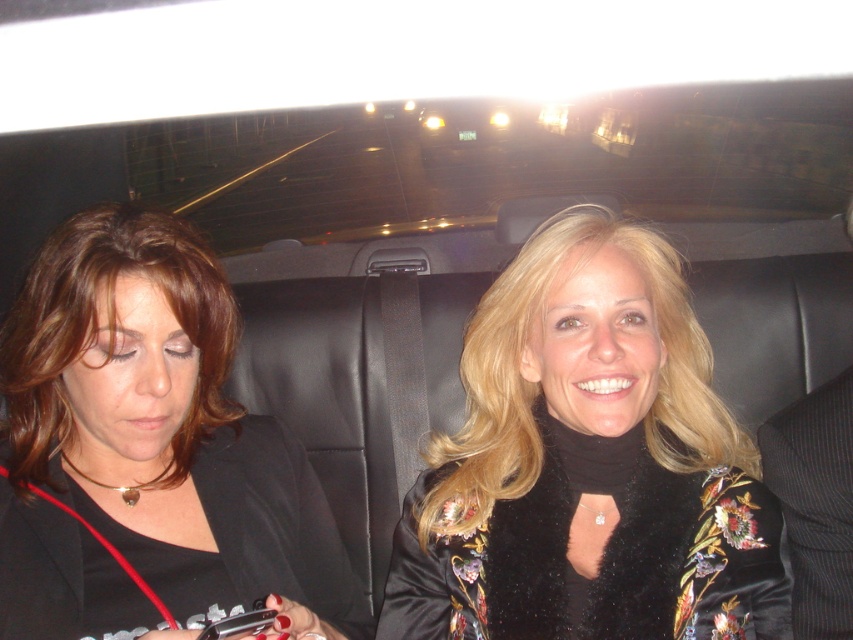
You are a fashion designer who wants to create a new collection using the two jackets from the image. The black velvet jacket at upper right and the matte black jacket at left. Which jacket should you choose if you want to create a design that emphasizes volume and grandeur?

The black velvet jacket at upper right is bigger than the matte black jacket at left, so it would be the better choice for emphasizing volume and grandeur in the design.

You are a fashion designer observing two jackets in a photo. The black velvet jacket at upper right and the matte black jacket at left. Which jacket is positioned higher in the image?

The black velvet jacket at upper right is positioned higher in the image than the matte black jacket at left.